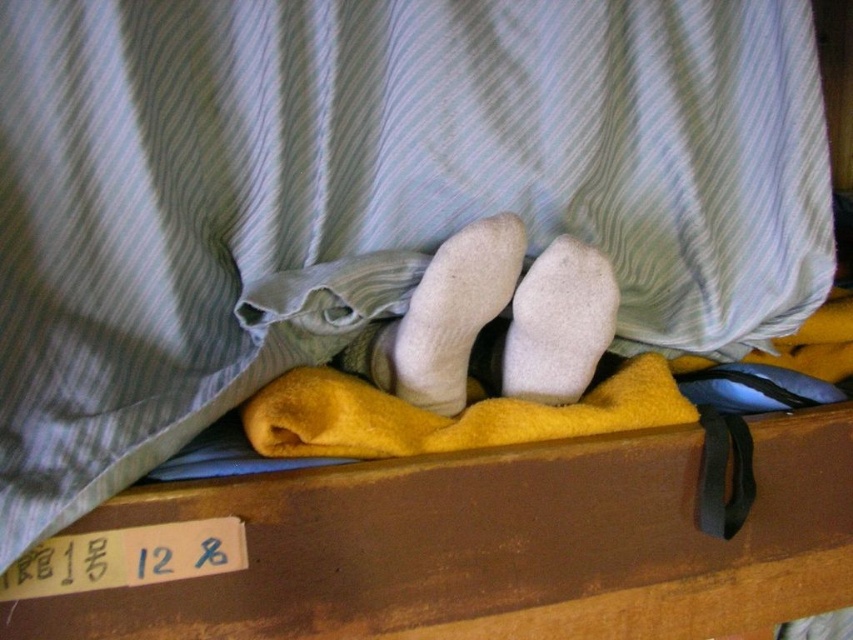
Question: Can you confirm if white soft socks at center is wider than white fuzzy sock at center?

Choices:
 (A) no
 (B) yes

Answer: (B)

Question: Which object appears farthest from the camera in this image?

Choices:
 (A) white soft socks at center
 (B) brown wooden drawer at lower center
 (C) white fuzzy sock at center

Answer: (C)

Question: Which point appears farthest from the camera in this image?

Choices:
 (A) (602, 316)
 (B) (831, 573)

Answer: (B)

Question: Does white soft socks at center appear on the right side of white fuzzy sock at center?

Choices:
 (A) yes
 (B) no

Answer: (B)

Question: Which point is closer to the camera?

Choices:
 (A) white fuzzy sock at center
 (B) brown wooden drawer at lower center

Answer: (B)

Question: Is white soft socks at center below white fuzzy sock at center?

Choices:
 (A) yes
 (B) no

Answer: (B)